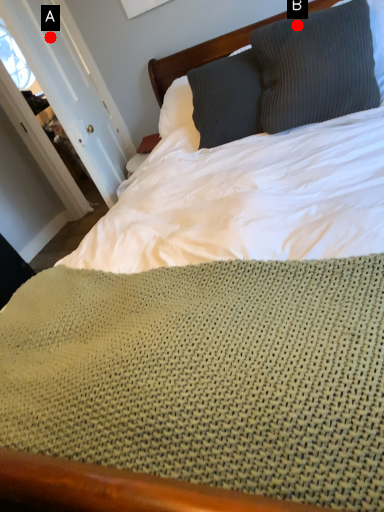
Question: Two points are circled on the image, labeled by A and B beside each circle. Which point is farther to the camera?

Choices:
 (A) A is further
 (B) B is further

Answer: (A)